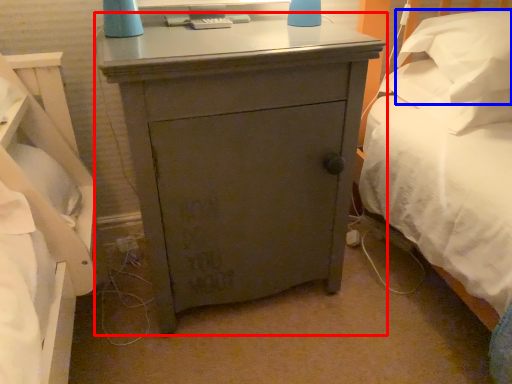
Question: Which object appears farthest to the camera in this image, nightstand (highlighted by a red box) or pillow (highlighted by a blue box)?

Choices:
 (A) nightstand
 (B) pillow

Answer: (B)